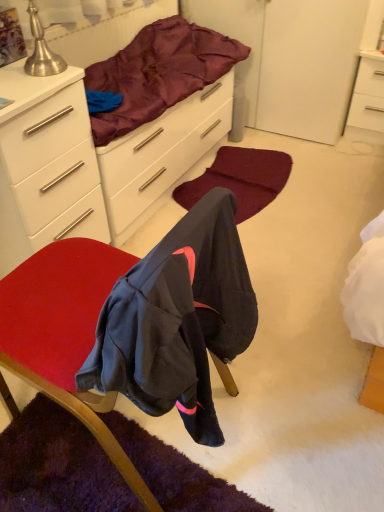
Locate an element on the screen. The height and width of the screenshot is (512, 384). free point above burgundy carpet at center (from a real-world perspective) is located at coordinates (252, 166).